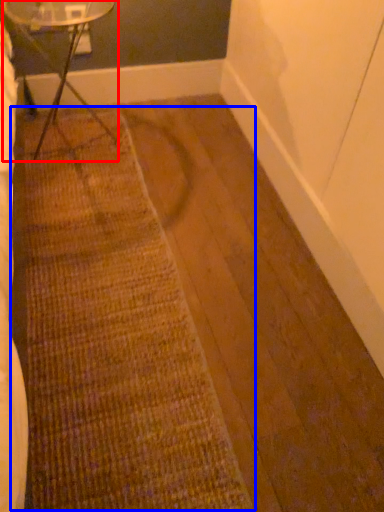
Question: Which object is closer to the camera taking this photo, table (highlighted by a red box) or doormat (highlighted by a blue box)?

Choices:
 (A) table
 (B) doormat

Answer: (B)